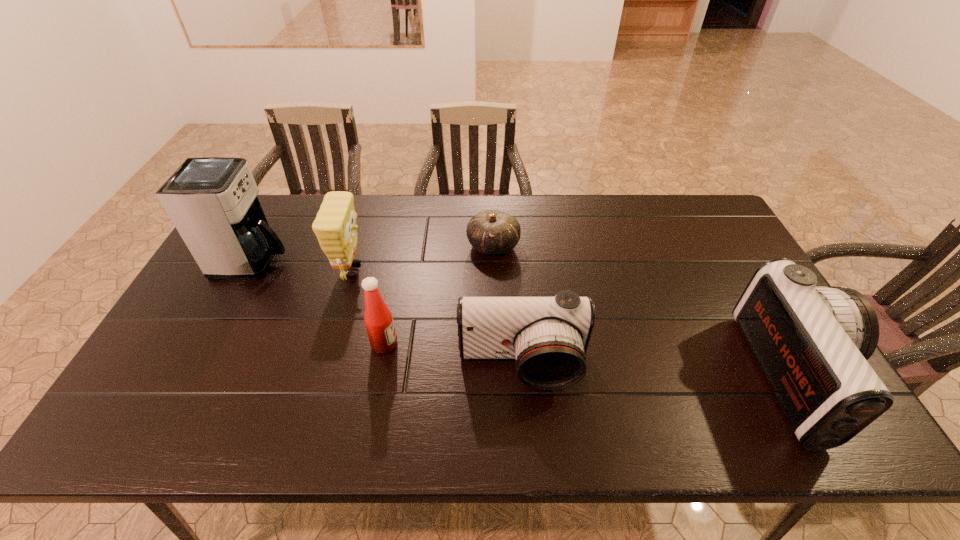
Please point a vacant point for placing a camcorder on the left. Please provide its 2D coordinates. Your answer should be formatted as a tuple, i.e. [(x, y)], where the tuple contains the x and y coordinates of a point satisfying the conditions above.

[(258, 354)]